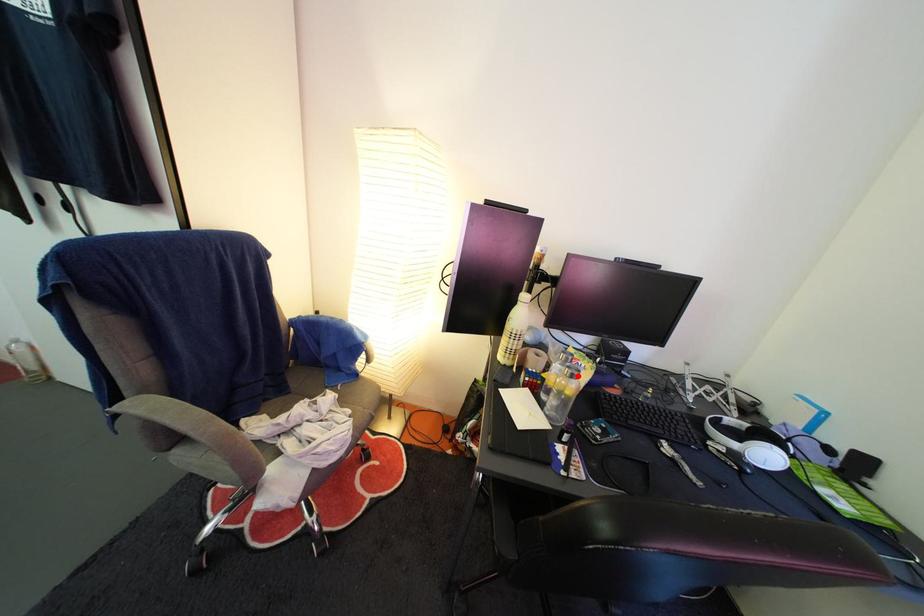
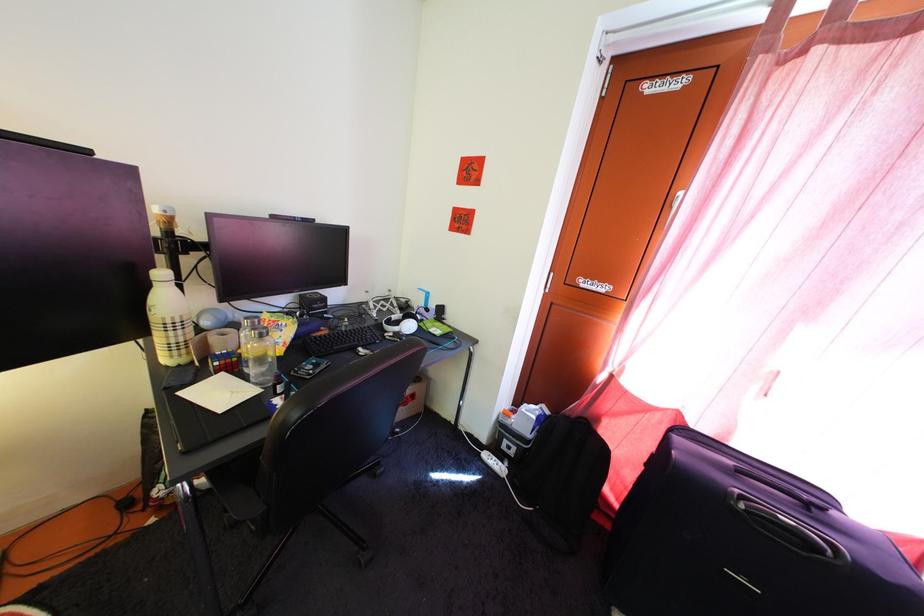
Find the pixel in the second image that matches the highlighted location in the first image.

(262, 338)